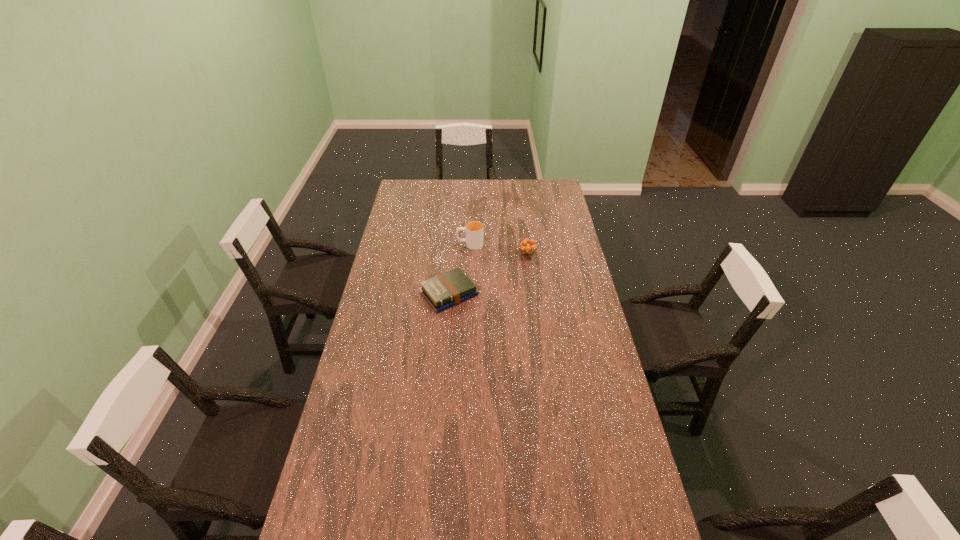
Locate an element on the screen. This screenshot has width=960, height=540. free space at the far edge of the desktop is located at coordinates (512, 181).

This screenshot has height=540, width=960. Find the location of `vacant space at the left edge of the desktop`. vacant space at the left edge of the desktop is located at coordinates (361, 354).

Image resolution: width=960 pixels, height=540 pixels. What are the coordinates of `vacant space at the right edge of the desktop` in the screenshot? It's located at (559, 277).

In the image, there is a desktop. At what (x,y) coordinates should I click in order to perform the action: click on vacant space at the far left corner. Please return your answer as a coordinate pair (x, y). Looking at the image, I should click on (406, 180).

This screenshot has height=540, width=960. I want to click on free space at the far right corner of the desktop, so click(543, 179).

Find the location of a particular element. Image resolution: width=960 pixels, height=540 pixels. vacant point located between the second shortest object and the book is located at coordinates (488, 273).

Where is `empty space between the orange fruit and the tallest object`? empty space between the orange fruit and the tallest object is located at coordinates (498, 248).

At what (x,y) coordinates should I click in order to perform the action: click on free space between the orange fruit and the tallest object. Please return your answer as a coordinate pair (x, y). Looking at the image, I should click on (498, 248).

What are the coordinates of `blank region between the tallest object and the rightmost object` in the screenshot? It's located at (498, 248).

Where is `free space that is in between the tallest object and the orange fruit`? The image size is (960, 540). free space that is in between the tallest object and the orange fruit is located at coordinates (498, 248).